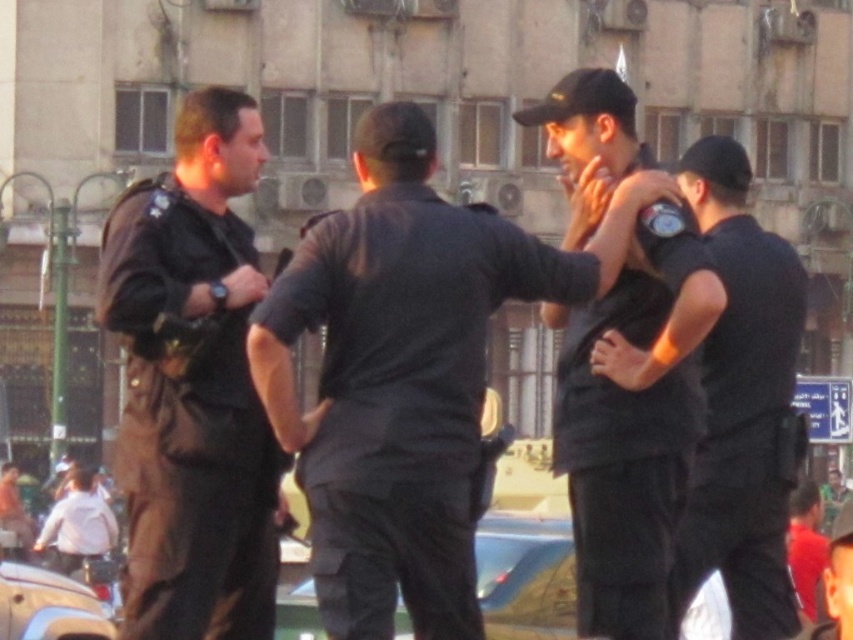
Between black matte shirt at right and white matte shirt at lower left, which one is positioned higher?

black matte shirt at right is above.

Which is more to the right, black matte shirt at right or white matte shirt at lower left?

Positioned to the right is black matte shirt at right.

Between point (782, 307) and point (78, 561), which one is positioned in front?

Point (782, 307)

Identify the location of black matte shirt at right. (746, 435).

Is dark brown uniform at left shorter than black matte shirt at right?

No, dark brown uniform at left is not shorter than black matte shirt at right.

Does dark brown uniform at left have a lesser width compared to black matte shirt at right?

No.

Image resolution: width=853 pixels, height=640 pixels. What are the coordinates of `dark brown uniform at left` in the screenshot? It's located at (193, 385).

Is black matte shirt at center closer to camera compared to black matte shirt at right?

Yes, black matte shirt at center is in front of black matte shirt at right.

Consider the image. Who is lower down, black matte shirt at center or black matte shirt at right?

Positioned lower is black matte shirt at right.

Does point (570, 257) come in front of point (741, 598)?

Yes, point (570, 257) is in front of point (741, 598).

Find the location of a particular element. The height and width of the screenshot is (640, 853). black matte shirt at center is located at coordinates (402, 376).